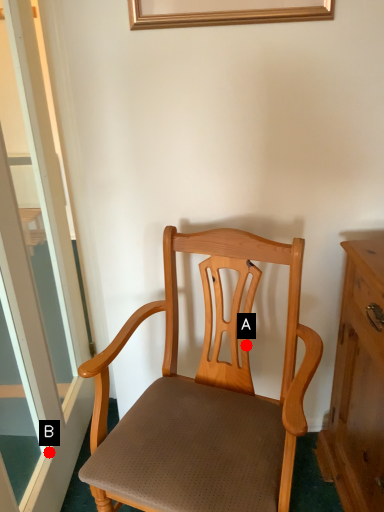
Question: Two points are circled on the image, labeled by A and B beside each circle. Which point is closer to the camera?

Choices:
 (A) A is closer
 (B) B is closer

Answer: (B)